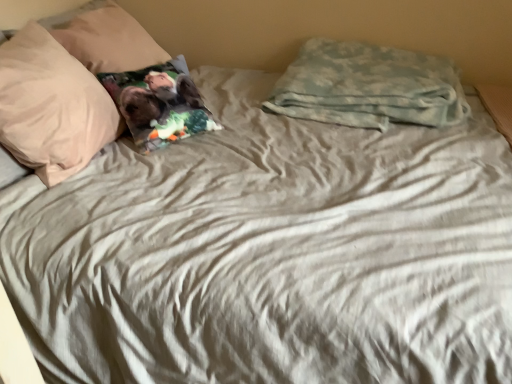
What do you see at coordinates (105, 38) in the screenshot? The height and width of the screenshot is (384, 512). I see `printed fabric pillow at left, the 3th pillow positioned from the right` at bounding box center [105, 38].

The image size is (512, 384). Find the location of `camouflage fabric pillow at upper right, the 4th pillow in the left-to-right sequence`. camouflage fabric pillow at upper right, the 4th pillow in the left-to-right sequence is located at coordinates (369, 86).

Identify the location of printed fabric pillow at upper left, the 2th pillow positioned from the right. (159, 104).

What's the angular difference between printed fabric pillow at upper left, which is counted as the 3th pillow, starting from the left, and camouflage fabric pillow at upper right, the 4th pillow in the left-to-right sequence,'s facing directions?

There is a 35.4-degree angle between the facing directions of printed fabric pillow at upper left, which is counted as the 3th pillow, starting from the left, and camouflage fabric pillow at upper right, the 4th pillow in the left-to-right sequence.

Is printed fabric pillow at upper left, the 2th pillow positioned from the right, wider than camouflage fabric pillow at upper right, the 4th pillow in the left-to-right sequence?

No.

Is printed fabric pillow at upper left, which is counted as the 3th pillow, starting from the left, shorter than camouflage fabric pillow at upper right, the 4th pillow in the left-to-right sequence?

No, printed fabric pillow at upper left, which is counted as the 3th pillow, starting from the left, is not shorter than camouflage fabric pillow at upper right, the 4th pillow in the left-to-right sequence.

Is printed fabric pillow at upper left, which is counted as the 3th pillow, starting from the left, at the right side of camouflage fabric pillow at upper right, which is the first pillow from right to left?

In fact, printed fabric pillow at upper left, which is counted as the 3th pillow, starting from the left, is to the left of camouflage fabric pillow at upper right, which is the first pillow from right to left.

From a real-world perspective, between camouflage fabric pillow at upper right, which is the first pillow from right to left, and beige soft pillow at upper left, which is the fourth pillow in right-to-left order, who is vertically lower?

From a 3D spatial view, camouflage fabric pillow at upper right, which is the first pillow from right to left, is below.

Is camouflage fabric pillow at upper right, the 4th pillow in the left-to-right sequence, bigger or smaller than beige soft pillow at upper left, arranged as the 1th pillow when viewed from the left?

Considering their sizes, camouflage fabric pillow at upper right, the 4th pillow in the left-to-right sequence, takes up more space than beige soft pillow at upper left, arranged as the 1th pillow when viewed from the left.

Is camouflage fabric pillow at upper right, the 4th pillow in the left-to-right sequence, facing towards beige soft pillow at upper left, arranged as the 1th pillow when viewed from the left?

No, camouflage fabric pillow at upper right, the 4th pillow in the left-to-right sequence, is not facing towards beige soft pillow at upper left, arranged as the 1th pillow when viewed from the left.

Is beige soft pillow at upper left, which is the fourth pillow in right-to-left order, surrounded by camouflage fabric pillow at upper right, which is the first pillow from right to left?

No, beige soft pillow at upper left, which is the fourth pillow in right-to-left order, is not inside camouflage fabric pillow at upper right, which is the first pillow from right to left.

Considering the sizes of objects printed fabric pillow at upper left, which is counted as the 3th pillow, starting from the left, and printed fabric pillow at left, the second pillow when ordered from left to right, in the image provided, who is smaller, printed fabric pillow at upper left, which is counted as the 3th pillow, starting from the left, or printed fabric pillow at left, the second pillow when ordered from left to right,?

Smaller between the two is printed fabric pillow at upper left, which is counted as the 3th pillow, starting from the left.

Which object is wider, printed fabric pillow at upper left, which is counted as the 3th pillow, starting from the left, or printed fabric pillow at left, the 3th pillow positioned from the right?

With larger width is printed fabric pillow at left, the 3th pillow positioned from the right.

In the scene shown: From the image's perspective, between printed fabric pillow at upper left, which is counted as the 3th pillow, starting from the left, and printed fabric pillow at left, the second pillow when ordered from left to right, who is located below?

From the image's view, printed fabric pillow at upper left, which is counted as the 3th pillow, starting from the left, is below.

From the image's perspective, is beige soft pillow at upper left, arranged as the 1th pillow when viewed from the left, located beneath printed fabric pillow at upper left, the 2th pillow positioned from the right?

Yes, from the image's perspective, beige soft pillow at upper left, arranged as the 1th pillow when viewed from the left, is below printed fabric pillow at upper left, the 2th pillow positioned from the right.

Which object is thinner, beige soft pillow at upper left, which is the fourth pillow in right-to-left order, or printed fabric pillow at upper left, the 2th pillow positioned from the right?

printed fabric pillow at upper left, the 2th pillow positioned from the right, is thinner.

How many degrees apart are the facing directions of beige soft pillow at upper left, which is the fourth pillow in right-to-left order, and printed fabric pillow at upper left, the 2th pillow positioned from the right?

The angular difference between beige soft pillow at upper left, which is the fourth pillow in right-to-left order, and printed fabric pillow at upper left, the 2th pillow positioned from the right, is 34.7 degrees.

How many degrees apart are the facing directions of printed fabric pillow at left, the 3th pillow positioned from the right, and camouflage fabric pillow at upper right, the 4th pillow in the left-to-right sequence?

The angle between the facing direction of printed fabric pillow at left, the 3th pillow positioned from the right, and the facing direction of camouflage fabric pillow at upper right, the 4th pillow in the left-to-right sequence, is 1.36 degrees.

From a real-world perspective, is printed fabric pillow at left, the 3th pillow positioned from the right, below camouflage fabric pillow at upper right, which is the first pillow from right to left?

No.

Is printed fabric pillow at left, the 3th pillow positioned from the right, completely or partially outside of camouflage fabric pillow at upper right, which is the first pillow from right to left?

That's correct, printed fabric pillow at left, the 3th pillow positioned from the right, is outside of camouflage fabric pillow at upper right, which is the first pillow from right to left.

Looking at their sizes, would you say printed fabric pillow at left, the second pillow when ordered from left to right, is wider or thinner than camouflage fabric pillow at upper right, which is the first pillow from right to left?

printed fabric pillow at left, the second pillow when ordered from left to right, is wider than camouflage fabric pillow at upper right, which is the first pillow from right to left.

Is printed fabric pillow at left, the second pillow when ordered from left to right, wider than beige soft pillow at upper left, arranged as the 1th pillow when viewed from the left?

Correct, the width of printed fabric pillow at left, the second pillow when ordered from left to right, exceeds that of beige soft pillow at upper left, arranged as the 1th pillow when viewed from the left.

Is printed fabric pillow at left, the second pillow when ordered from left to right, next to beige soft pillow at upper left, which is the fourth pillow in right-to-left order?

They are not placed beside each other.

Does point (90, 7) lie behind point (54, 143)?

Yes.

Who is shorter, printed fabric pillow at left, the second pillow when ordered from left to right, or beige soft pillow at upper left, arranged as the 1th pillow when viewed from the left?

Standing shorter between the two is printed fabric pillow at left, the second pillow when ordered from left to right.

Is point (311, 102) farther from viewer compared to point (109, 6)?

No.

Would you consider camouflage fabric pillow at upper right, which is the first pillow from right to left, to be distant from printed fabric pillow at left, the second pillow when ordered from left to right?

camouflage fabric pillow at upper right, which is the first pillow from right to left, is near printed fabric pillow at left, the second pillow when ordered from left to right, not far away.

From the image's perspective, which one is positioned higher, camouflage fabric pillow at upper right, which is the first pillow from right to left, or printed fabric pillow at left, the second pillow when ordered from left to right?

printed fabric pillow at left, the second pillow when ordered from left to right.

Is camouflage fabric pillow at upper right, which is the first pillow from right to left, not inside printed fabric pillow at left, the second pillow when ordered from left to right?

Yes, camouflage fabric pillow at upper right, which is the first pillow from right to left, is located beyond the bounds of printed fabric pillow at left, the second pillow when ordered from left to right.

From the image's perspective, count 1st pillows downward from the camouflage fabric pillow at upper right, the 4th pillow in the left-to-right sequence, and point to it. Please provide its 2D coordinates.

[(159, 104)]

You are a GUI agent. You are given a task and a screenshot of the screen. Output one action in this format:
    pyautogui.click(x=<x>, y=<y>)
    Task: Click on the pillow that is the 2nd object above the camouflage fabric pillow at upper right, the 4th pillow in the left-to-right sequence (from a real-world perspective)
    
    Given the screenshot: What is the action you would take?
    pyautogui.click(x=51, y=106)

When comparing their distances from camouflage fabric pillow at upper right, the 4th pillow in the left-to-right sequence, does beige soft pillow at upper left, which is the fourth pillow in right-to-left order, or printed fabric pillow at left, the second pillow when ordered from left to right, seem closer?

The object closer to camouflage fabric pillow at upper right, the 4th pillow in the left-to-right sequence, is printed fabric pillow at left, the second pillow when ordered from left to right.

Which object lies further to the anchor point printed fabric pillow at upper left, which is counted as the 3th pillow, starting from the left, camouflage fabric pillow at upper right, the 4th pillow in the left-to-right sequence, or printed fabric pillow at left, the second pillow when ordered from left to right?

Among the two, camouflage fabric pillow at upper right, the 4th pillow in the left-to-right sequence, is located further to printed fabric pillow at upper left, which is counted as the 3th pillow, starting from the left.

Based on their spatial positions, is beige soft pillow at upper left, arranged as the 1th pillow when viewed from the left, or camouflage fabric pillow at upper right, the 4th pillow in the left-to-right sequence, closer to printed fabric pillow at upper left, which is counted as the 3th pillow, starting from the left?

beige soft pillow at upper left, arranged as the 1th pillow when viewed from the left, is positioned closer to the anchor printed fabric pillow at upper left, which is counted as the 3th pillow, starting from the left.

Which object lies nearer to the anchor point beige soft pillow at upper left, arranged as the 1th pillow when viewed from the left, printed fabric pillow at upper left, the 2th pillow positioned from the right, or printed fabric pillow at left, the 3th pillow positioned from the right?

printed fabric pillow at upper left, the 2th pillow positioned from the right.

Consider the image. From the image, which object appears to be nearer to beige soft pillow at upper left, which is the fourth pillow in right-to-left order, camouflage fabric pillow at upper right, which is the first pillow from right to left, or printed fabric pillow at upper left, which is counted as the 3th pillow, starting from the left?

printed fabric pillow at upper left, which is counted as the 3th pillow, starting from the left, is closer to beige soft pillow at upper left, which is the fourth pillow in right-to-left order.

Estimate the real-world distances between objects in this image. Which object is closer to printed fabric pillow at upper left, the 2th pillow positioned from the right, printed fabric pillow at left, the second pillow when ordered from left to right, or camouflage fabric pillow at upper right, the 4th pillow in the left-to-right sequence?

Based on the image, printed fabric pillow at left, the second pillow when ordered from left to right, appears to be nearer to printed fabric pillow at upper left, the 2th pillow positioned from the right.

Estimate the real-world distances between objects in this image. Which object is further from printed fabric pillow at left, the 3th pillow positioned from the right, camouflage fabric pillow at upper right, the 4th pillow in the left-to-right sequence, or printed fabric pillow at upper left, which is counted as the 3th pillow, starting from the left?

camouflage fabric pillow at upper right, the 4th pillow in the left-to-right sequence, is further to printed fabric pillow at left, the 3th pillow positioned from the right.

When comparing their distances from beige soft pillow at upper left, which is the fourth pillow in right-to-left order, does printed fabric pillow at left, the 3th pillow positioned from the right, or printed fabric pillow at upper left, the 2th pillow positioned from the right, seem closer?

printed fabric pillow at upper left, the 2th pillow positioned from the right, is positioned closer to the anchor beige soft pillow at upper left, which is the fourth pillow in right-to-left order.

Locate an element on the screen. pillow between printed fabric pillow at left, the second pillow when ordered from left to right, and camouflage fabric pillow at upper right, which is the first pillow from right to left, in the horizontal direction is located at coordinates (159, 104).

In order to click on pillow between beige soft pillow at upper left, which is the fourth pillow in right-to-left order, and printed fabric pillow at upper left, the 2th pillow positioned from the right in this screenshot , I will do `click(105, 38)`.